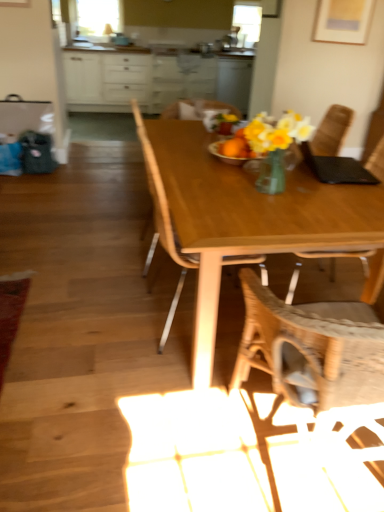
Question: Can you see woven fabric chair at center, acting as the 2th chair starting from the left, touching wooden chair at center, the first chair positioned from the left?

Choices:
 (A) yes
 (B) no

Answer: (B)

Question: Is woven fabric chair at center, marked as the 2th chair in a right-to-left arrangement, far from wooden chair at center, which ranks as the third chair in right-to-left order?

Choices:
 (A) no
 (B) yes

Answer: (A)

Question: From the image's perspective, is woven fabric chair at center, acting as the 2th chair starting from the left, located beneath wooden chair at center, which ranks as the third chair in right-to-left order?

Choices:
 (A) no
 (B) yes

Answer: (B)

Question: Considering the relative sizes of woven fabric chair at center, marked as the 2th chair in a right-to-left arrangement, and wooden chair at center, which ranks as the third chair in right-to-left order, in the image provided, is woven fabric chair at center, marked as the 2th chair in a right-to-left arrangement, bigger than wooden chair at center, which ranks as the third chair in right-to-left order,?

Choices:
 (A) no
 (B) yes

Answer: (B)

Question: Is woven fabric chair at center, marked as the 2th chair in a right-to-left arrangement, at the left side of wooden chair at center, which ranks as the third chair in right-to-left order?

Choices:
 (A) yes
 (B) no

Answer: (B)

Question: From a real-world perspective, is wooden table at center physically located above or below woven fabric chair at center, acting as the 2th chair starting from the left?

Choices:
 (A) below
 (B) above

Answer: (A)

Question: Relative to woven fabric chair at center, marked as the 2th chair in a right-to-left arrangement, is wooden table at center in front or behind?

Choices:
 (A) behind
 (B) front

Answer: (A)

Question: Is wooden table at center taller or shorter than woven fabric chair at center, acting as the 2th chair starting from the left?

Choices:
 (A) short
 (B) tall

Answer: (A)

Question: Is wooden table at center inside or outside of woven fabric chair at center, acting as the 2th chair starting from the left?

Choices:
 (A) outside
 (B) inside

Answer: (A)

Question: From the image's perspective, is white glossy cabinets at upper center above or below clear glass window screen at upper left?

Choices:
 (A) above
 (B) below

Answer: (B)

Question: Considering the positions of white glossy cabinets at upper center and clear glass window screen at upper left in the image, is white glossy cabinets at upper center bigger or smaller than clear glass window screen at upper left?

Choices:
 (A) big
 (B) small

Answer: (A)

Question: Is point (109, 80) positioned closer to the camera than point (105, 17)?

Choices:
 (A) farther
 (B) closer

Answer: (A)

Question: Choose the correct answer: Is white glossy cabinets at upper center inside clear glass window screen at upper left or outside it?

Choices:
 (A) outside
 (B) inside

Answer: (A)

Question: Is white glossy cabinets at upper center situated inside wooden chair at center, marked as the third chair in a left-to-right arrangement, or outside?

Choices:
 (A) outside
 (B) inside

Answer: (A)

Question: Based on their positions, is white glossy cabinets at upper center located to the left or right of wooden chair at center, marked as the third chair in a left-to-right arrangement?

Choices:
 (A) right
 (B) left

Answer: (B)